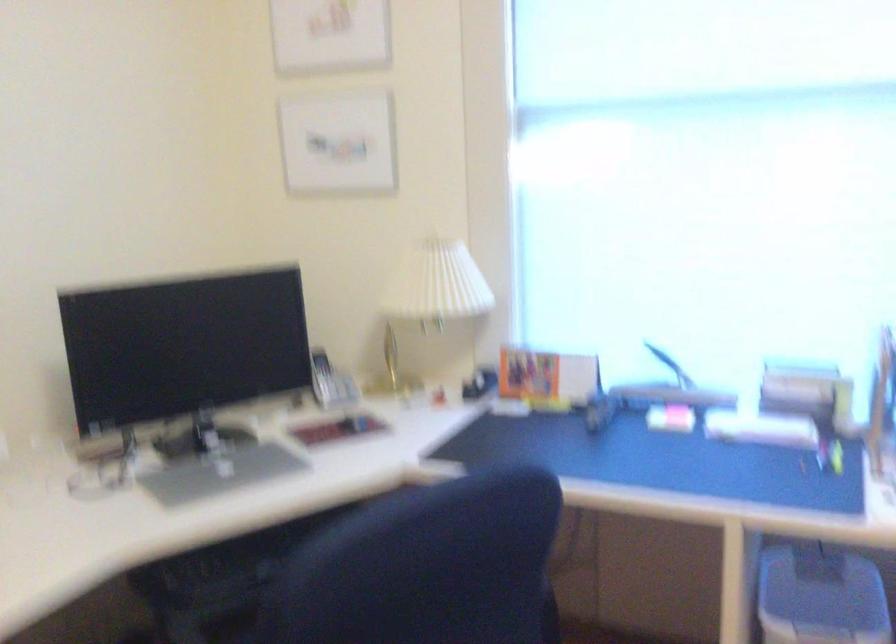
Find where to sit the chair sitting surface. Please return your answer as a coordinate pair (x, y).

(233, 625)